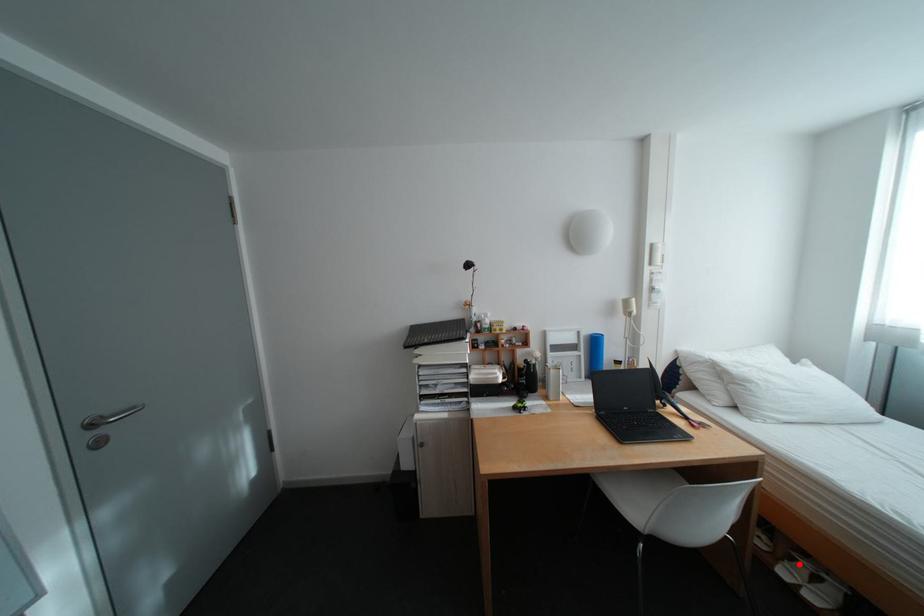
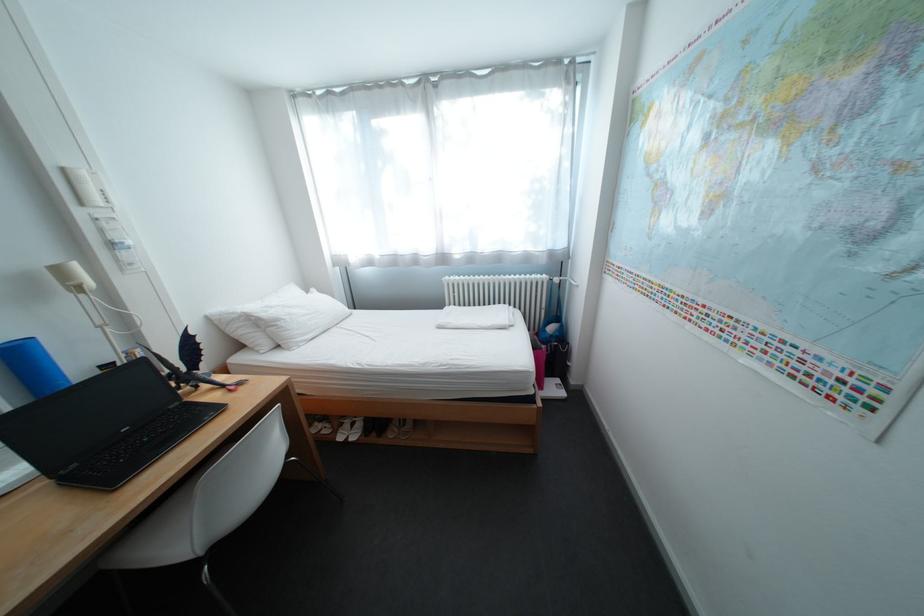
The point at the highlighted location is marked in the first image. Where is the corresponding point in the second image?

(353, 431)